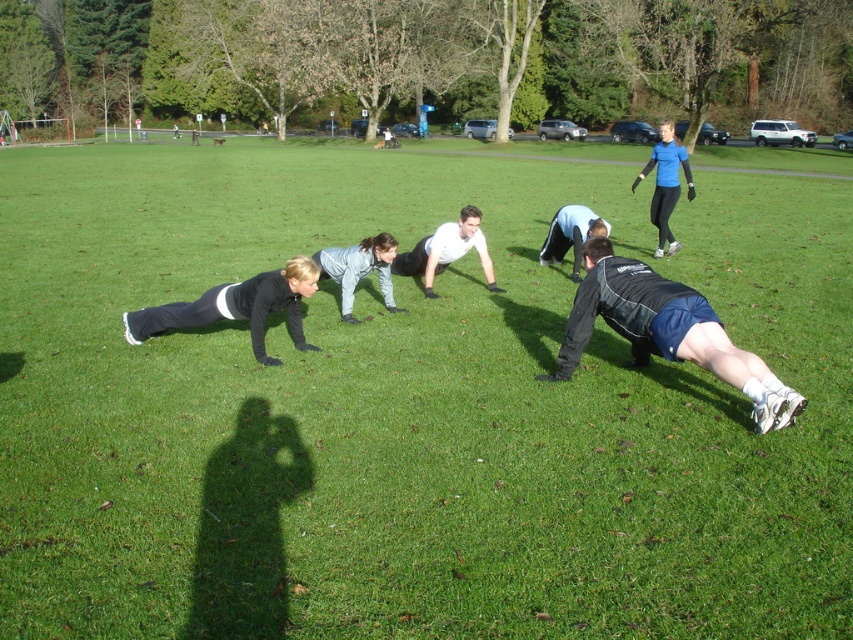
Question: Which object is the farthest from the black matte shorts at lower right?

Choices:
 (A) white matte shirt at center
 (B) blue matte jacket at upper right

Answer: (B)

Question: Which is nearer to the black matte shorts at lower right?

Choices:
 (A) gray fleece jacket at center
 (B) black matte jacket at lower left
 (C) light blue fabric shirt at center
 (D) blue matte jacket at upper right

Answer: (B)

Question: Observing the image, what is the correct spatial positioning of black matte shorts at lower right in reference to blue matte jacket at upper right?

Choices:
 (A) above
 (B) below

Answer: (B)

Question: Among these points, which one is nearest to the camera?

Choices:
 (A) (364, 273)
 (B) (579, 317)
 (C) (672, 157)
 (D) (451, 257)

Answer: (B)

Question: Is black matte shorts at lower right thinner than light blue fabric shirt at center?

Choices:
 (A) no
 (B) yes

Answer: (A)

Question: Does gray fleece jacket at center come in front of blue matte jacket at upper right?

Choices:
 (A) yes
 (B) no

Answer: (A)